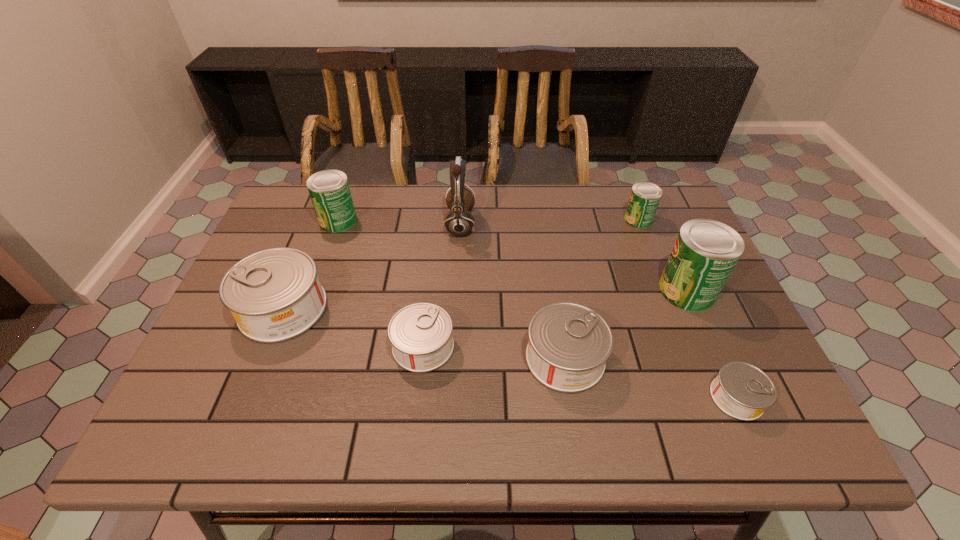
Where is `free space that satisfies the following two spatial constraints: 1. on the ear pads of the earphone; 2. on the right side of the shortest can`? free space that satisfies the following two spatial constraints: 1. on the ear pads of the earphone; 2. on the right side of the shortest can is located at coordinates (451, 397).

What are the coordinates of `free space that satisfies the following two spatial constraints: 1. on the ear pads of the tallest object; 2. on the left side of the rightmost silver can` in the screenshot? It's located at (451, 397).

This screenshot has height=540, width=960. I want to click on free location that satisfies the following two spatial constraints: 1. on the ear pads of the brown earphone; 2. on the left side of the smallest silver can, so click(451, 397).